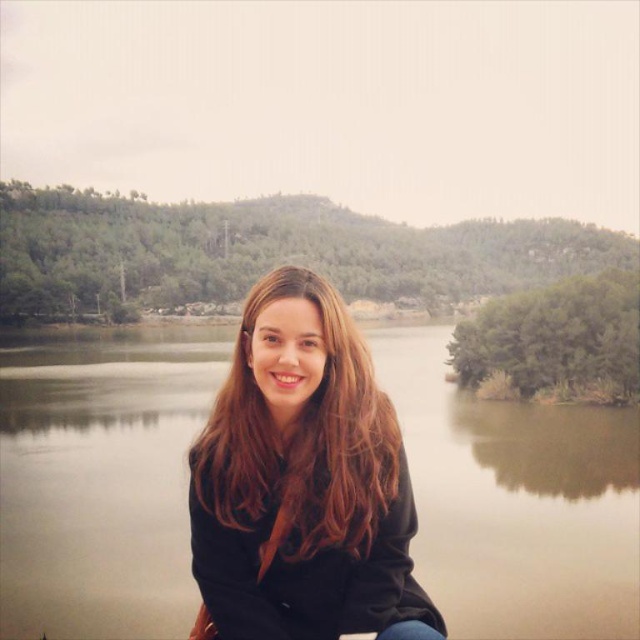
You are a photographer trying to capture the reflection of the green matte water at center in your shot. Since the brown hair at center might interfere with the reflection, can you estimate whether the water is large enough to frame without the hair?

The green matte water at center has a larger size compared to brown hair at center, so yes, the water is large enough to frame without including the brown hair at center in the reflection shot.

Based on the scene description, can you identify the object located at the coordinates point (x=100, y=477)?

The object at point (x=100, y=477) is green matte water at center.